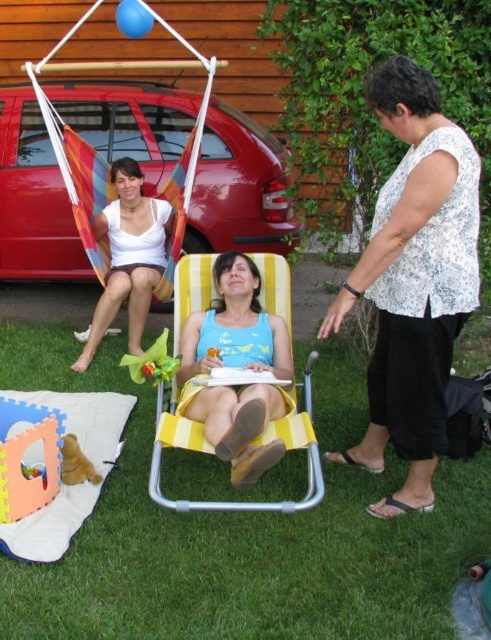
Who is taller, metallic red car at left or white fabric hammock at upper left?

Standing taller between the two is metallic red car at left.

From the picture: Can you confirm if metallic red car at left is bigger than white fabric hammock at upper left?

Yes, metallic red car at left is bigger than white fabric hammock at upper left.

Locate an element on the screen. This screenshot has height=640, width=491. metallic red car at left is located at coordinates pos(240,188).

Does white dotted blouse at center have a greater height compared to soft foam play mat at lower left?

Yes.

Is white dotted blouse at center further to the viewer compared to soft foam play mat at lower left?

No.

From the picture: Measure the distance between white dotted blouse at center and camera.

white dotted blouse at center and camera are 2.22 meters apart from each other.

Where is `white dotted blouse at center`? This screenshot has height=640, width=491. white dotted blouse at center is located at coordinates (413, 280).

How much distance is there between metallic red car at left and yellow fabric beach chair at center?

A distance of 2.52 meters exists between metallic red car at left and yellow fabric beach chair at center.

Can you confirm if metallic red car at left is thinner than yellow fabric beach chair at center?

In fact, metallic red car at left might be wider than yellow fabric beach chair at center.

Consider the image. Who is more distant from viewer, (283, 170) or (200, 502)?

Point (283, 170)

The height and width of the screenshot is (640, 491). What are the coordinates of `metallic red car at left` in the screenshot? It's located at (240, 188).